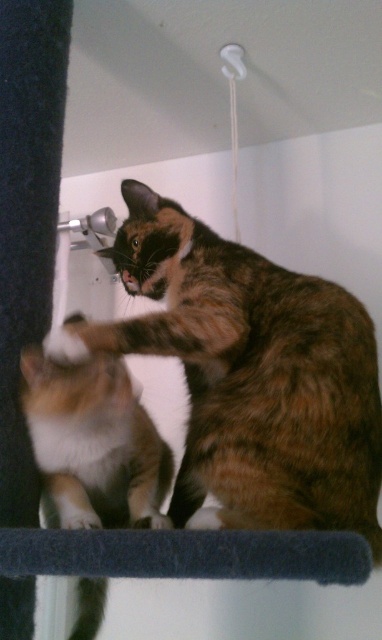
Question: Can you confirm if calico fur cat at center is thinner than calico fur cat at lower left?

Choices:
 (A) yes
 (B) no

Answer: (B)

Question: Which point is closer to the camera?

Choices:
 (A) calico fur cat at lower left
 (B) calico fur cat at center

Answer: (B)

Question: Is calico fur cat at center positioned at the back of calico fur cat at lower left?

Choices:
 (A) no
 (B) yes

Answer: (A)

Question: Observing the image, what is the correct spatial positioning of calico fur cat at center in reference to calico fur cat at lower left?

Choices:
 (A) below
 (B) above

Answer: (B)